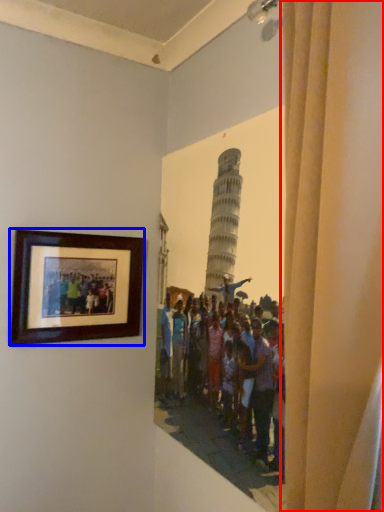
Question: Which point is closer to the camera, curtain (highlighted by a red box) or picture frame (highlighted by a blue box)?

Choices:
 (A) curtain
 (B) picture frame

Answer: (A)